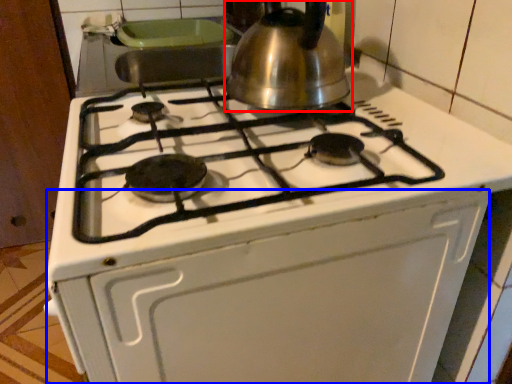
Question: Which point is further to the camera, kettle (highlighted by a red box) or oven (highlighted by a blue box)?

Choices:
 (A) kettle
 (B) oven

Answer: (A)